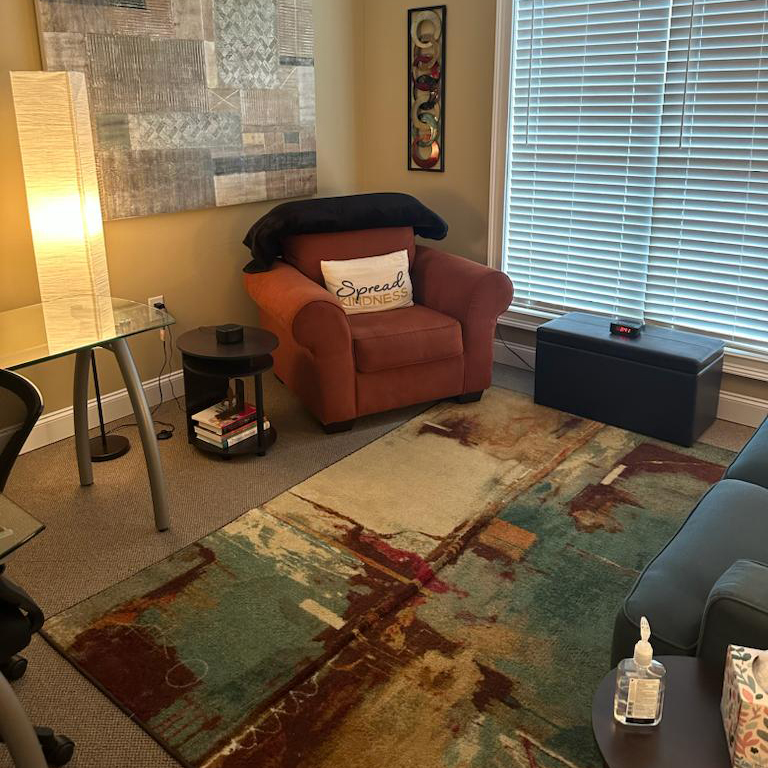
The width and height of the screenshot is (768, 768). I want to click on lamp, so click(70, 184).